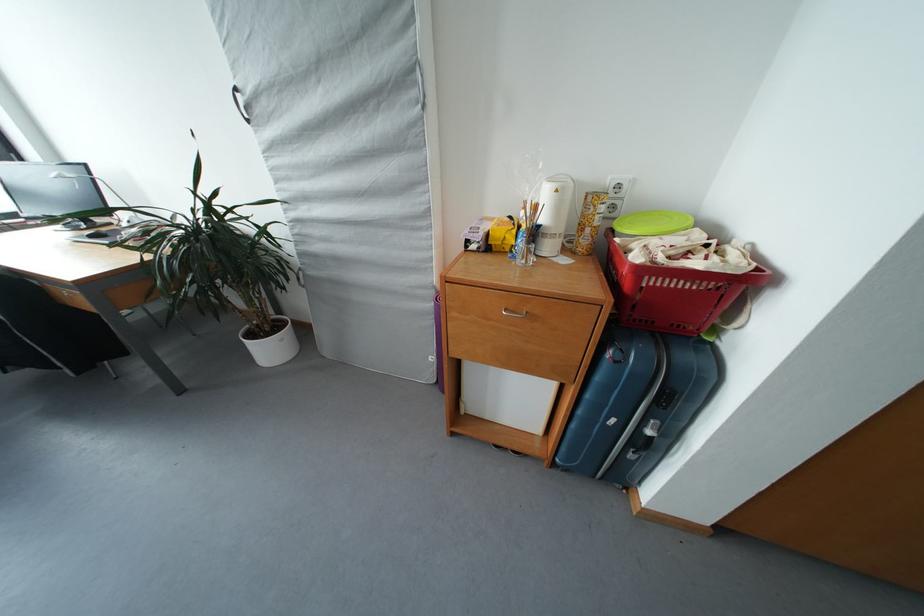
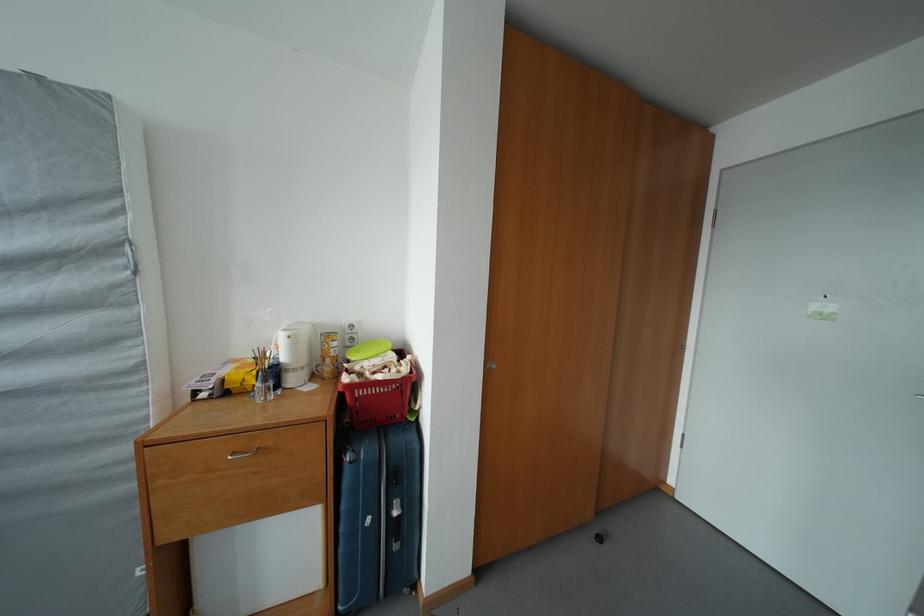
How did the camera likely rotate?

The rotation direction of the camera is right-up.